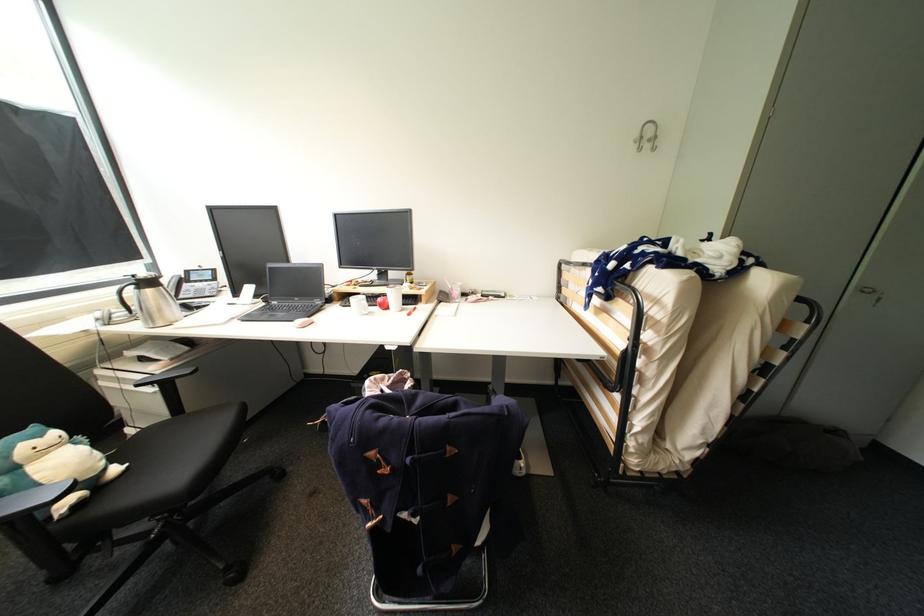
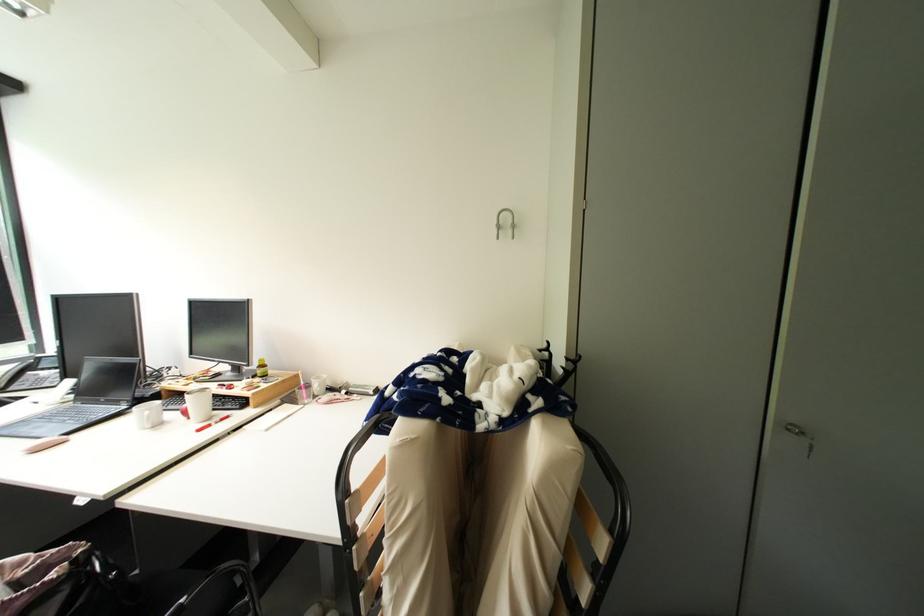
Question: How did the camera likely rotate?

Choices:
 (A) Left
 (B) Right
 (C) Up
 (D) Down

Answer: (C)